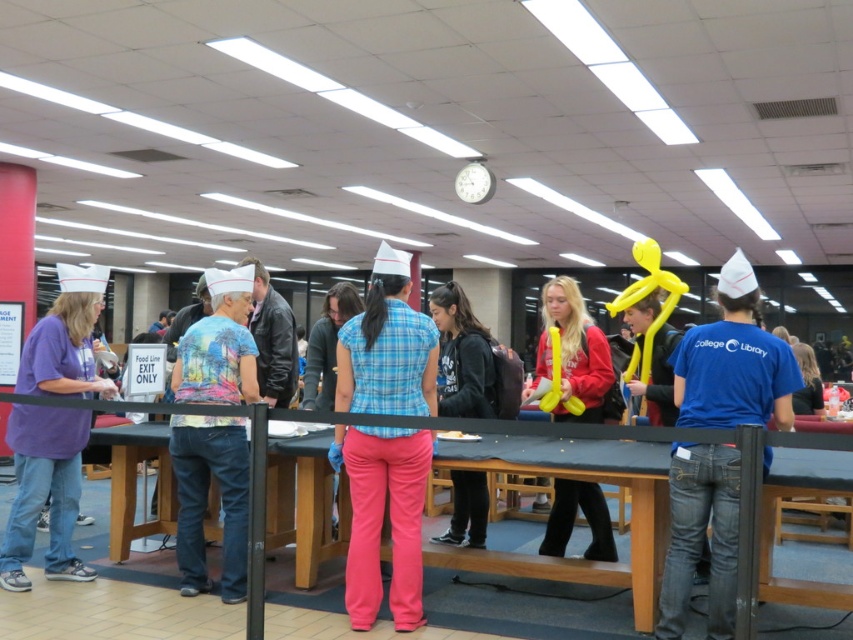
You are organizing a school event and need to place a decorative banner between the black hoodie at center and the white plastic clock at upper center. Based on their positions, where should you position the banner so it is centered between them?

The black hoodie at center is to the left of the white plastic clock at upper center, so the banner should be placed between them, closer to the middle of the two objects to ensure it is centered.

You are organizing a school event and need to place a decorative banner between the black hoodie at center and the white plastic clock at upper center. The banner requires 2.5 meters of space. Is there enough space between them?

The distance between the black hoodie at center and the white plastic clock at upper center is 3.11 meters, which is more than the required 2.5 meters. Therefore, there is enough space to place the banner between them.

You are standing at the point with coordinates point (236, 300) and want to walk towards the point with coordinates point (705, 404). Based on the scene description, which direction should you move relative to your current position?

Since point (705, 404) is in front of point (236, 300), you should move forward in the direction towards the point (705, 404).